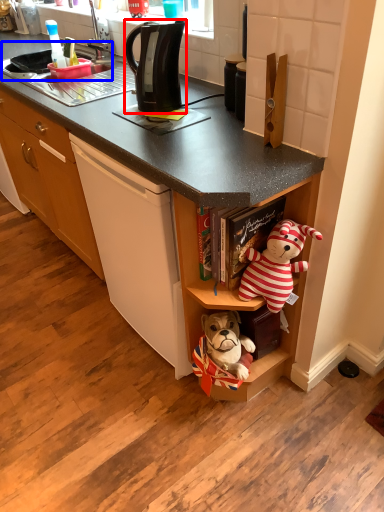
Question: Which of the following is the farthest to the observer, kitchen appliance (highlighted by a red box) or sink (highlighted by a blue box)?

Choices:
 (A) kitchen appliance
 (B) sink

Answer: (B)